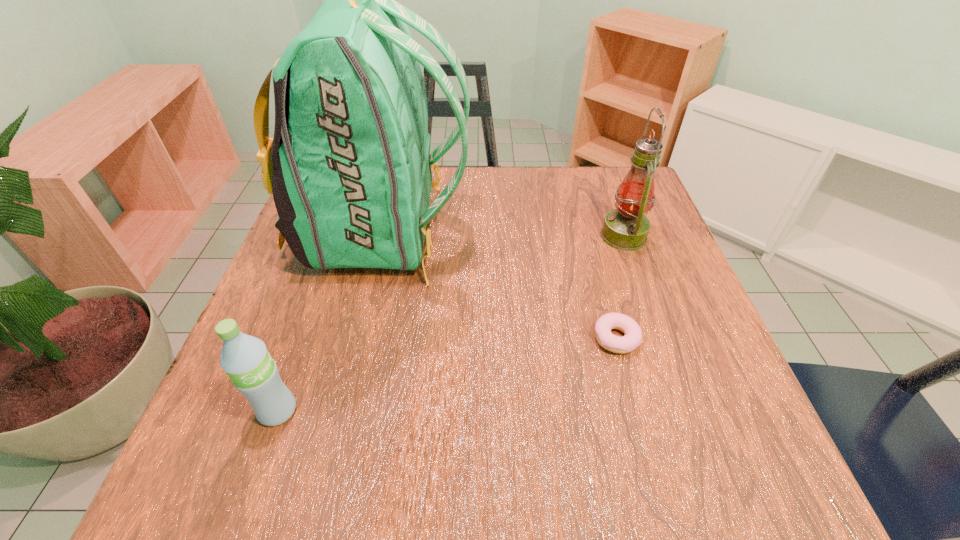
Where is `vacant space that is in between the water bottle and the doughnut`? This screenshot has height=540, width=960. vacant space that is in between the water bottle and the doughnut is located at coordinates (446, 375).

Find the location of a particular element. This screenshot has height=540, width=960. free space between the nearest object and the oil lamp is located at coordinates (450, 323).

At what (x,y) coordinates should I click in order to perform the action: click on object that can be found as the closest to the second shortest object. Please return your answer as a coordinate pair (x, y). Looking at the image, I should click on (349, 166).

What are the coordinates of `the closest object relative to the tallest object` in the screenshot? It's located at (245, 359).

Where is `vacant area that satisfies the following two spatial constraints: 1. on the back of the tallest object; 2. on the left side of the third shortest object`? Image resolution: width=960 pixels, height=540 pixels. vacant area that satisfies the following two spatial constraints: 1. on the back of the tallest object; 2. on the left side of the third shortest object is located at coordinates (381, 236).

What are the coordinates of `vacant space that satisfies the following two spatial constraints: 1. on the back of the backpack; 2. on the left side of the oil lamp` in the screenshot? It's located at (381, 236).

You are a GUI agent. You are given a task and a screenshot of the screen. Output one action in this format:
    pyautogui.click(x=<x>, y=<y>)
    Task: Click on the free spot that satisfies the following two spatial constraints: 1. on the back of the backpack; 2. on the right side of the shortest object
    This screenshot has width=960, height=540.
    Given the screenshot: What is the action you would take?
    pyautogui.click(x=356, y=339)

I want to click on free spot that satisfies the following two spatial constraints: 1. on the back side of the oil lamp; 2. on the back of the backpack, so click(622, 233).

This screenshot has width=960, height=540. Find the location of `free spot that satisfies the following two spatial constraints: 1. on the back of the shortest object; 2. on the left side of the tallest object`. free spot that satisfies the following two spatial constraints: 1. on the back of the shortest object; 2. on the left side of the tallest object is located at coordinates (356, 339).

The height and width of the screenshot is (540, 960). Identify the location of free location that satisfies the following two spatial constraints: 1. on the back of the tallest object; 2. on the left side of the oil lamp. (381, 236).